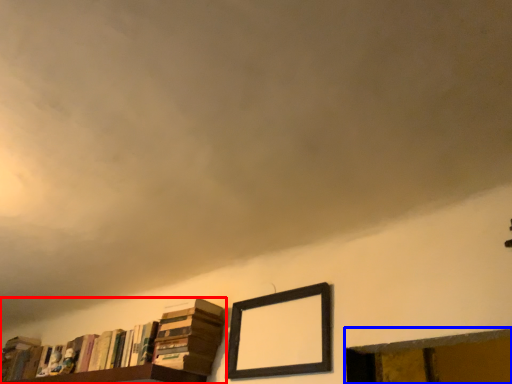
Question: Which object appears farthest to the camera in this image, book (highlighted by a red box) or window frame (highlighted by a blue box)?

Choices:
 (A) book
 (B) window frame

Answer: (A)